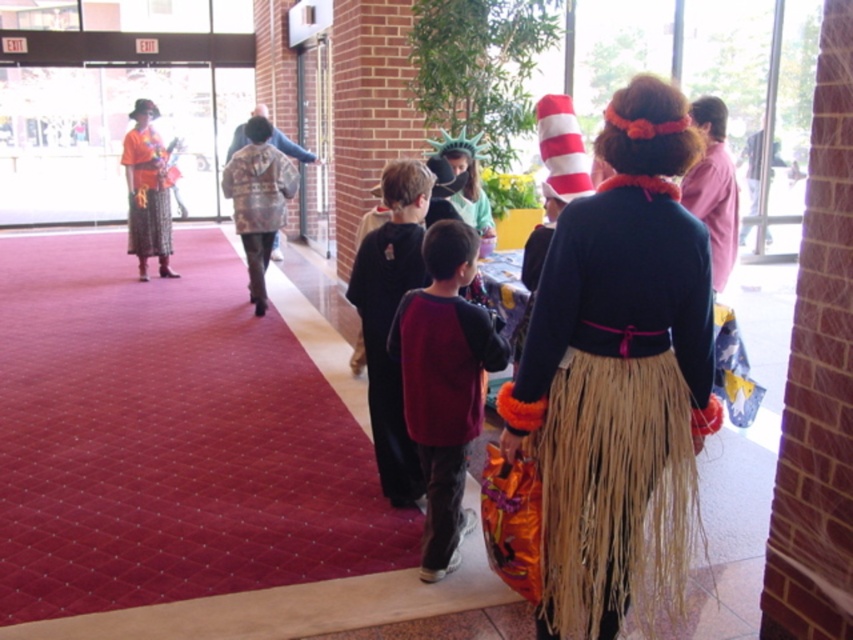
You are standing in the hall and want to take a photo of both the point at (477, 417) and the point at (380, 244). Which point should you focus on first to ensure both are in focus?

You should focus on the point at (380, 244) first because it is farther from the camera than the point at (477, 417), ensuring both will be in focus when using depth of field.

You are a costume designer looking at the image and want to adjust the layers of the maroon fleece sweater at center and the velvet maroon vest at center. Which one should you move to the front to make the vest more visible?

The maroon fleece sweater at center is positioned under the velvet maroon vest at center, so to make the vest more visible, you should move the maroon fleece sweater at center to the front.

In the scene shown: You are a photographer trying to capture both the patterned fabric cape at center and the orange printed fabric skirt at left in a single shot. Since you want to ensure both are visible, which object should you focus on first to account for their sizes?

You should focus on the patterned fabric cape at center first because it has a greater height compared to the orange printed fabric skirt at left, making it more prominent in the frame.